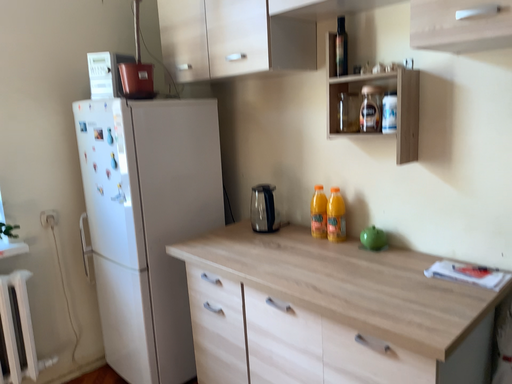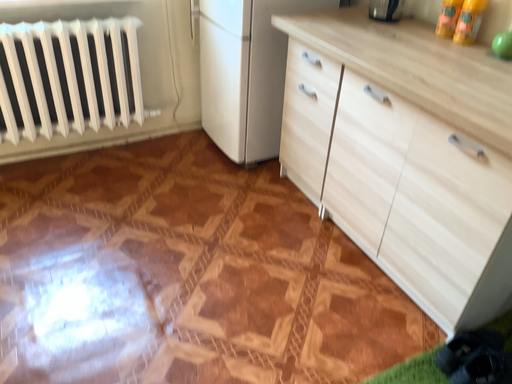
Question: Which way did the camera rotate in the video?

Choices:
 (A) rotated downward
 (B) rotated upward

Answer: (A)